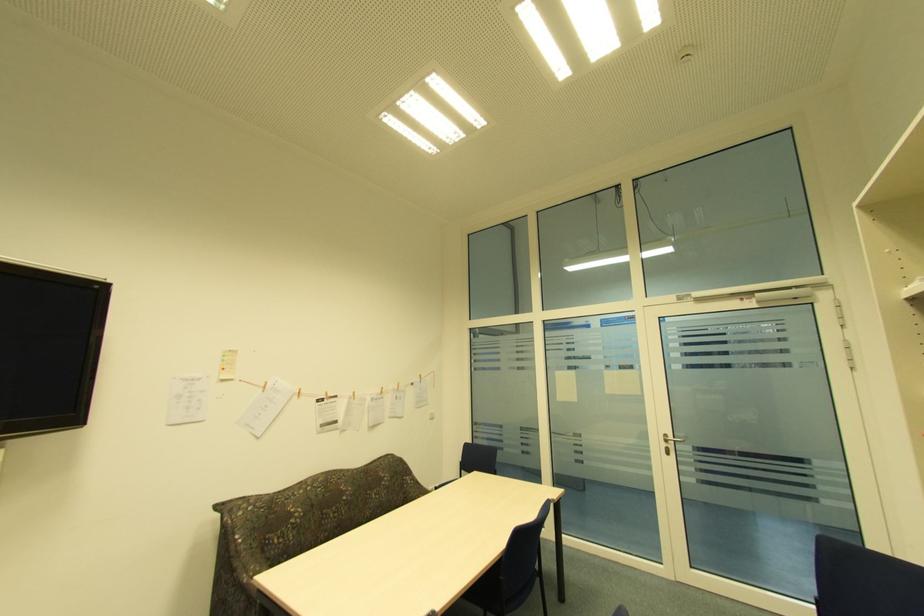
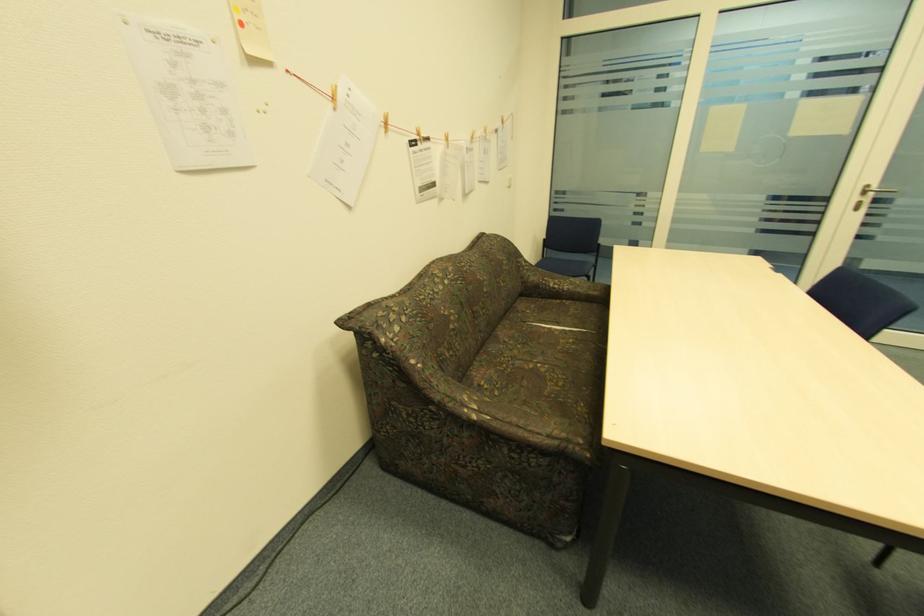
Locate, in the second image, the point that corresponds to (666,445) in the first image.

(859, 199)